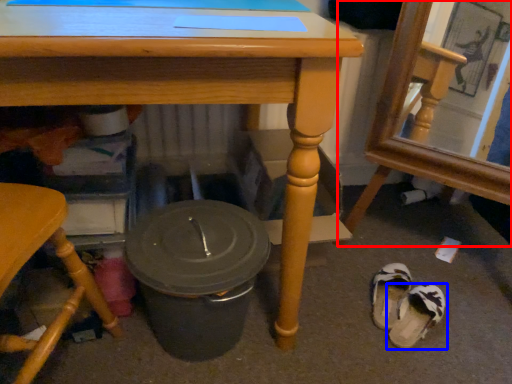
Question: Which object is closer to the camera taking this photo, chair (highlighted by a red box) or footwear (highlighted by a blue box)?

Choices:
 (A) chair
 (B) footwear

Answer: (A)